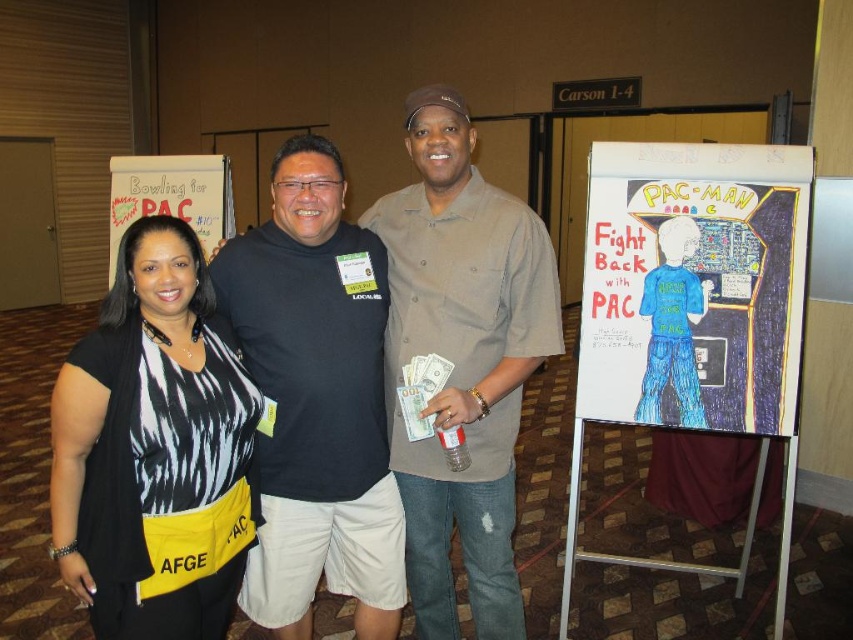
Image resolution: width=853 pixels, height=640 pixels. Find the location of `colored paper drawing at right`. colored paper drawing at right is located at coordinates 693,308.

Between colored paper drawing at right and black cotton shirt at center, which one is positioned lower?

colored paper drawing at right is lower down.

Between point (788, 291) and point (283, 323), which one is positioned in front?

Point (283, 323) is in front.

In order to click on colored paper drawing at right in this screenshot , I will do `click(693, 308)`.

Can you confirm if colored paper drawing at right is bigger than black and white printed shirt at center?

Yes.

Can you confirm if colored paper drawing at right is smaller than black and white printed shirt at center?

No, colored paper drawing at right is not smaller than black and white printed shirt at center.

Is point (688, 205) in front of point (64, 531)?

No, it is behind (64, 531).

I want to click on colored paper drawing at right, so click(693, 308).

Find the location of a particular element. Image resolution: width=853 pixels, height=640 pixels. black and white printed shirt at center is located at coordinates (154, 448).

Which is above, black and white printed shirt at center or colored paper drawing of pac-man at right?

Positioned higher is colored paper drawing of pac-man at right.

Identify the location of black and white printed shirt at center. The image size is (853, 640). (154, 448).

Where is `black and white printed shirt at center`? black and white printed shirt at center is located at coordinates pyautogui.click(x=154, y=448).